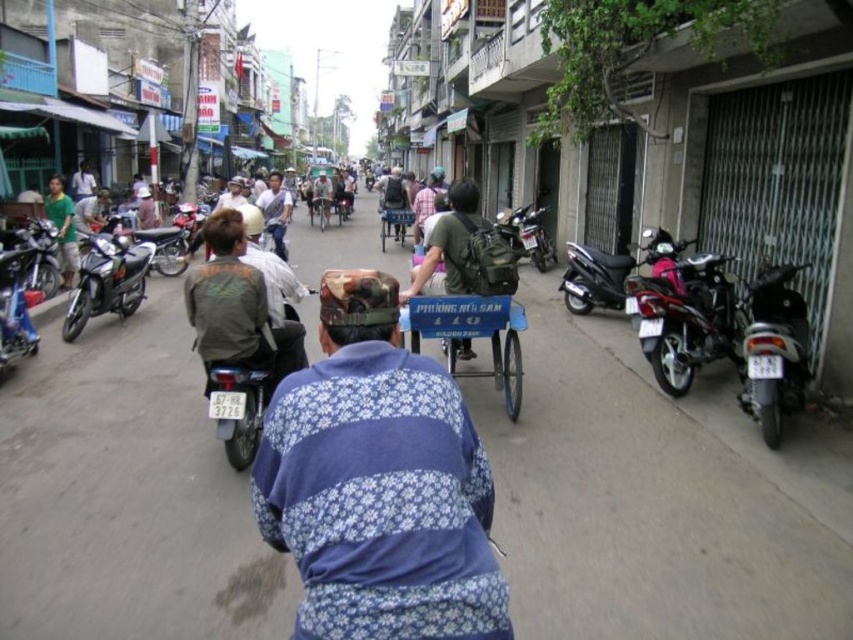
Question: Which of the following is the farthest from the observer?

Choices:
 (A) wooden cart at center
 (B) silver metallic motorcycle at left
 (C) blue painted wood cart at center
 (D) metallic blue cart at center

Answer: (A)

Question: Can you confirm if metallic blue cart at center is wider than wooden cart at center?

Choices:
 (A) yes
 (B) no

Answer: (A)

Question: Does shiny metallic motorcycle at right appear on the right side of shiny silver motorcycle at left?

Choices:
 (A) yes
 (B) no

Answer: (A)

Question: Can you confirm if silver metallic motorcycle at right is positioned above wooden cart at center?

Choices:
 (A) no
 (B) yes

Answer: (A)

Question: Which point appears closest to the camera in this image?

Choices:
 (A) click(80, 284)
 (B) click(583, 294)
 (C) click(166, 259)

Answer: (A)

Question: Which point appears closest to the camera in this image?

Choices:
 (A) (660, 353)
 (B) (381, 246)

Answer: (A)